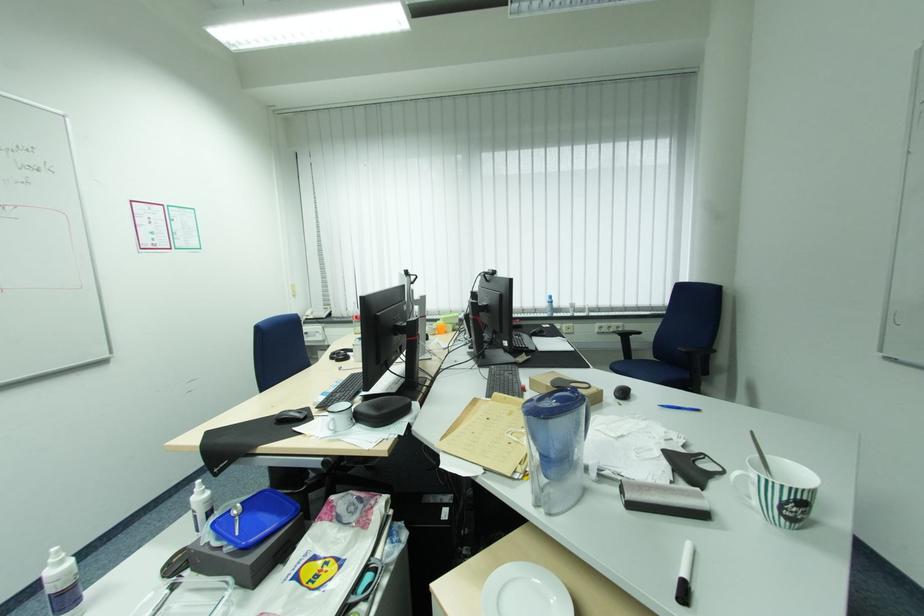
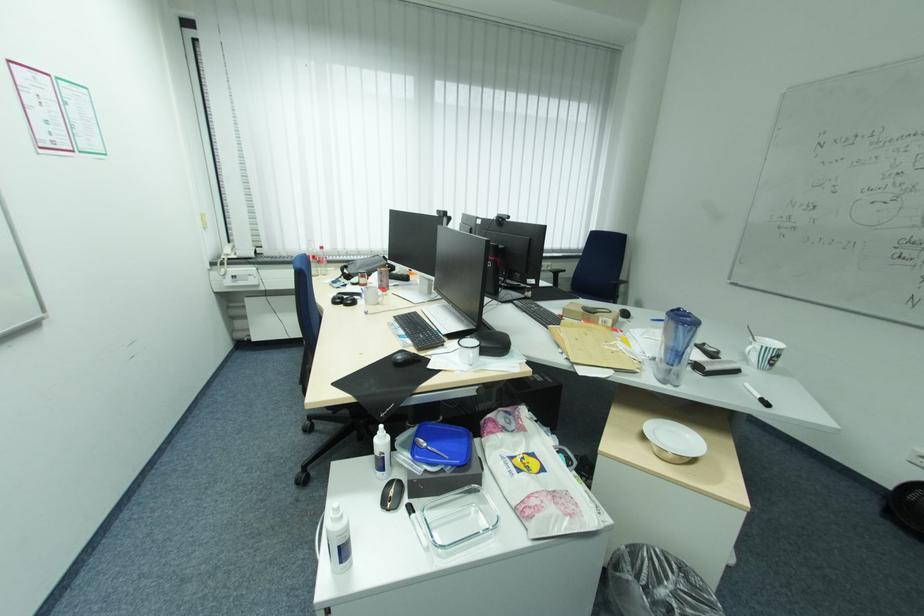
Where in the second image is the point corresponding to point 313,315 from the first image?

(234, 254)